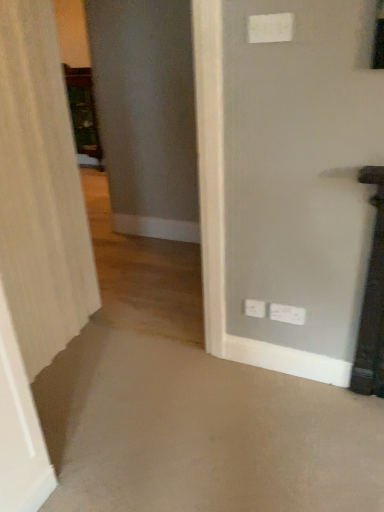
What do you see at coordinates (40, 191) in the screenshot?
I see `white textured curtain at left` at bounding box center [40, 191].

Find the location of `wooden cabinet at left`. wooden cabinet at left is located at coordinates (83, 116).

At what (x,y) coordinates should I click in order to perform the action: click on white plastic electric outlet at lower right, the first electric outlet from the back. Please return your answer as a coordinate pair (x, y). Looking at the image, I should click on (254, 308).

Identify the location of white textured curtain at left. (40, 191).

Looking at this image, from the image's perspective, which is below, white textured curtain at left or wooden cabinet at left?

white textured curtain at left appears lower in the image.

From a real-world perspective, is white textured curtain at left positioned above or below wooden cabinet at left?

white textured curtain at left is above wooden cabinet at left.

Is the depth of white textured curtain at left less than that of wooden cabinet at left?

Yes, it is.

Between white textured curtain at left and wooden cabinet at left, which one has more height?

white textured curtain at left is taller.

Does white plastic electric outlet at lower right, the first electric outlet from the back, have a lesser height compared to white plastic electric outlet at upper center, arranged as the first electric outlet when viewed from the top?

In fact, white plastic electric outlet at lower right, the first electric outlet from the back, may be taller than white plastic electric outlet at upper center, arranged as the first electric outlet when viewed from the top.

From a real-world perspective, starting from the white plastic electric outlet at lower right, which is the 2th electric outlet from top to bottom, which electric outlet is the 2nd one vertically above it? Please provide its 2D coordinates.

[(270, 28)]

Which is in front, white plastic electric outlet at lower right, which is the 2th electric outlet from top to bottom, or white plastic electric outlet at upper center, arranged as the first electric outlet when viewed from the top?

white plastic electric outlet at upper center, arranged as the first electric outlet when viewed from the top, is in front.

From a real-world perspective, relative to white plastic electric outlet at upper center, arranged as the first electric outlet when viewed from the top, is white plastic electric outlet at lower right, which is counted as the 3th electric outlet, starting from the front, vertically above or below?

In terms of real-world spatial position, white plastic electric outlet at lower right, which is counted as the 3th electric outlet, starting from the front, is below white plastic electric outlet at upper center, arranged as the first electric outlet when viewed from the top.

Is white plastic electric outlet at upper center, arranged as the first electric outlet when viewed from the front, wider or thinner than white plastic electric outlet at lower right, placed as the 2th electric outlet when sorted from bottom to top?

In the image, white plastic electric outlet at upper center, arranged as the first electric outlet when viewed from the front, appears to be more narrow than white plastic electric outlet at lower right, placed as the 2th electric outlet when sorted from bottom to top.

From the image's perspective, does white plastic electric outlet at upper center, arranged as the first electric outlet when viewed from the top, appear higher than white plastic electric outlet at lower right, the first electric outlet from the back?

Indeed, from the image's perspective, white plastic electric outlet at upper center, arranged as the first electric outlet when viewed from the top, is shown above white plastic electric outlet at lower right, the first electric outlet from the back.

From a real-world perspective, is white plastic electric outlet at upper center, the 3th electric outlet positioned from the bottom, on top of white plastic electric outlet at lower right, which is counted as the 3th electric outlet, starting from the front?

Correct, in the physical world, white plastic electric outlet at upper center, the 3th electric outlet positioned from the bottom, is higher than white plastic electric outlet at lower right, which is counted as the 3th electric outlet, starting from the front.

Could you tell me if white plastic electric outlet at upper center, the 3th electric outlet positioned from the bottom, is facing white plastic electric outlet at lower right, which is the 2th electric outlet from top to bottom?

No, white plastic electric outlet at upper center, the 3th electric outlet positioned from the bottom, is not oriented towards white plastic electric outlet at lower right, which is the 2th electric outlet from top to bottom.

Is white plastic electric outlet at lower right, which is the second electric outlet in front-to-back order, next to wooden cabinet at left?

No, white plastic electric outlet at lower right, which is the second electric outlet in front-to-back order, is not beside wooden cabinet at left.

Is white plastic electric outlet at lower right, which is counted as the 1th electric outlet, starting from the bottom, at the left side of wooden cabinet at left?

In fact, white plastic electric outlet at lower right, which is counted as the 1th electric outlet, starting from the bottom, is to the right of wooden cabinet at left.

Where is `furniture on the left of white plastic electric outlet at lower right, which is counted as the 1th electric outlet, starting from the bottom`? This screenshot has width=384, height=512. furniture on the left of white plastic electric outlet at lower right, which is counted as the 1th electric outlet, starting from the bottom is located at coordinates (83, 116).

Is wooden cabinet at left to the left or to the right of white plastic electric outlet at lower right, which is the 2th electric outlet from top to bottom, in the image?

From the image, it's evident that wooden cabinet at left is to the left of white plastic electric outlet at lower right, which is the 2th electric outlet from top to bottom.

Considering the sizes of objects wooden cabinet at left and white plastic electric outlet at lower right, which is the 2th electric outlet from top to bottom, in the image provided, who is wider, wooden cabinet at left or white plastic electric outlet at lower right, which is the 2th electric outlet from top to bottom,?

With larger width is wooden cabinet at left.

Looking at this image, is wooden cabinet at left inside or outside of white plastic electric outlet at lower right, which is the 2th electric outlet from top to bottom?

wooden cabinet at left is located beyond the bounds of white plastic electric outlet at lower right, which is the 2th electric outlet from top to bottom.

Which of these two, white textured curtain at left or white plastic electric outlet at upper center, the 3th electric outlet positioned from the bottom, is smaller?

white plastic electric outlet at upper center, the 3th electric outlet positioned from the bottom, is smaller.

Does point (6, 17) appear closer or farther from the camera than point (251, 42)?

Point (6, 17) is farther from the camera than point (251, 42).

From the image's perspective, would you say white textured curtain at left is shown under white plastic electric outlet at upper center, the 3th electric outlet positioned from the bottom?

Yes, from the image's perspective, white textured curtain at left is beneath white plastic electric outlet at upper center, the 3th electric outlet positioned from the bottom.

Is white textured curtain at left positioned with its back to white plastic electric outlet at upper center, the 3th electric outlet positioned from the bottom?

No.

Is white plastic electric outlet at lower right, which is the 2th electric outlet from top to bottom, not near white plastic electric outlet at lower right, which is the second electric outlet in front-to-back order?

No.

Which object is positioned more to the left, white plastic electric outlet at lower right, the first electric outlet from the back, or white plastic electric outlet at lower right, which is counted as the 1th electric outlet, starting from the bottom?

Positioned to the left is white plastic electric outlet at lower right, the first electric outlet from the back.

Based on the photo, between white plastic electric outlet at lower right, which is counted as the 3th electric outlet, starting from the front, and white plastic electric outlet at lower right, which is the second electric outlet in front-to-back order, which one is positioned in front?

white plastic electric outlet at lower right, which is the second electric outlet in front-to-back order, is more forward.

From the image's perspective, which is above, white plastic electric outlet at lower right, the first electric outlet from the back, or white plastic electric outlet at lower right, which is the second electric outlet in front-to-back order?

white plastic electric outlet at lower right, the first electric outlet from the back, from the image's perspective.

This screenshot has height=512, width=384. What are the coordinates of `curtain that is above the wooden cabinet at left (from a real-world perspective)` in the screenshot? It's located at (40, 191).

Where is `electric outlet that is the 1st one when counting rightward from the white plastic electric outlet at upper center, arranged as the third electric outlet when viewed from the back`? The image size is (384, 512). electric outlet that is the 1st one when counting rightward from the white plastic electric outlet at upper center, arranged as the third electric outlet when viewed from the back is located at coordinates (254, 308).

Which object lies nearer to the anchor point wooden cabinet at left, white plastic electric outlet at upper center, arranged as the first electric outlet when viewed from the front, or white plastic electric outlet at lower right, placed as the 2th electric outlet when sorted from bottom to top?

white plastic electric outlet at upper center, arranged as the first electric outlet when viewed from the front, is closer to wooden cabinet at left.

Estimate the real-world distances between objects in this image. Which object is closer to white plastic electric outlet at lower right, the first electric outlet from the back, white plastic electric outlet at upper center, arranged as the first electric outlet when viewed from the top, or white textured curtain at left?

white plastic electric outlet at upper center, arranged as the first electric outlet when viewed from the top, lies closer to white plastic electric outlet at lower right, the first electric outlet from the back, than the other object.

Based on their spatial positions, is white plastic electric outlet at lower right, the first electric outlet from the back, or white plastic electric outlet at upper center, the 3th electric outlet positioned from the bottom, closer to wooden cabinet at left?

The object closer to wooden cabinet at left is white plastic electric outlet at upper center, the 3th electric outlet positioned from the bottom.

When comparing their distances from white plastic electric outlet at upper center, arranged as the third electric outlet when viewed from the back, does white plastic electric outlet at lower right, placed as the 2th electric outlet when sorted from bottom to top, or white textured curtain at left seem closer?

The object closer to white plastic electric outlet at upper center, arranged as the third electric outlet when viewed from the back, is white plastic electric outlet at lower right, placed as the 2th electric outlet when sorted from bottom to top.

From the picture: Which object lies further to the anchor point white textured curtain at left, white plastic electric outlet at upper center, the 3th electric outlet positioned from the bottom, or wooden cabinet at left?

wooden cabinet at left is positioned further to the anchor white textured curtain at left.

Estimate the real-world distances between objects in this image. Which object is further from white plastic electric outlet at lower right, which is the second electric outlet in front-to-back order, white plastic electric outlet at upper center, arranged as the first electric outlet when viewed from the top, or wooden cabinet at left?

wooden cabinet at left.

Based on their spatial positions, is white plastic electric outlet at lower right, which is the 2th electric outlet from top to bottom, or wooden cabinet at left closer to white plastic electric outlet at lower right, which is the 2th electric outlet in back-to-front order?

The object closer to white plastic electric outlet at lower right, which is the 2th electric outlet in back-to-front order, is white plastic electric outlet at lower right, which is the 2th electric outlet from top to bottom.

Estimate the real-world distances between objects in this image. Which object is closer to wooden cabinet at left, white plastic electric outlet at lower right, which is counted as the 3th electric outlet, starting from the front, or white plastic electric outlet at lower right, which is the 2th electric outlet in back-to-front order?

white plastic electric outlet at lower right, which is the 2th electric outlet in back-to-front order.

Where is `electric outlet between white plastic electric outlet at lower right, which is counted as the 1th electric outlet, starting from the bottom, and wooden cabinet at left from front to back`? This screenshot has width=384, height=512. electric outlet between white plastic electric outlet at lower right, which is counted as the 1th electric outlet, starting from the bottom, and wooden cabinet at left from front to back is located at coordinates (254, 308).

At what (x,y) coordinates should I click in order to perform the action: click on electric outlet located between white textured curtain at left and white plastic electric outlet at lower right, which is counted as the 3th electric outlet, starting from the front, in the left-right direction. Please return your answer as a coordinate pair (x, y). The height and width of the screenshot is (512, 384). Looking at the image, I should click on (270, 28).

Where is `electric outlet between white plastic electric outlet at upper center, arranged as the third electric outlet when viewed from the back, and white plastic electric outlet at lower right, which is the second electric outlet in front-to-back order, from top to bottom`? The width and height of the screenshot is (384, 512). electric outlet between white plastic electric outlet at upper center, arranged as the third electric outlet when viewed from the back, and white plastic electric outlet at lower right, which is the second electric outlet in front-to-back order, from top to bottom is located at coordinates (254, 308).